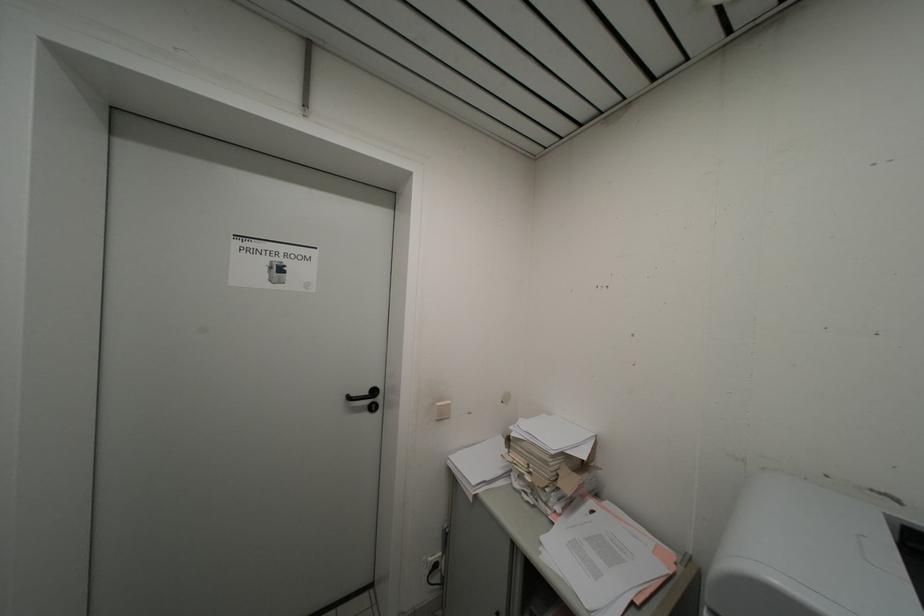
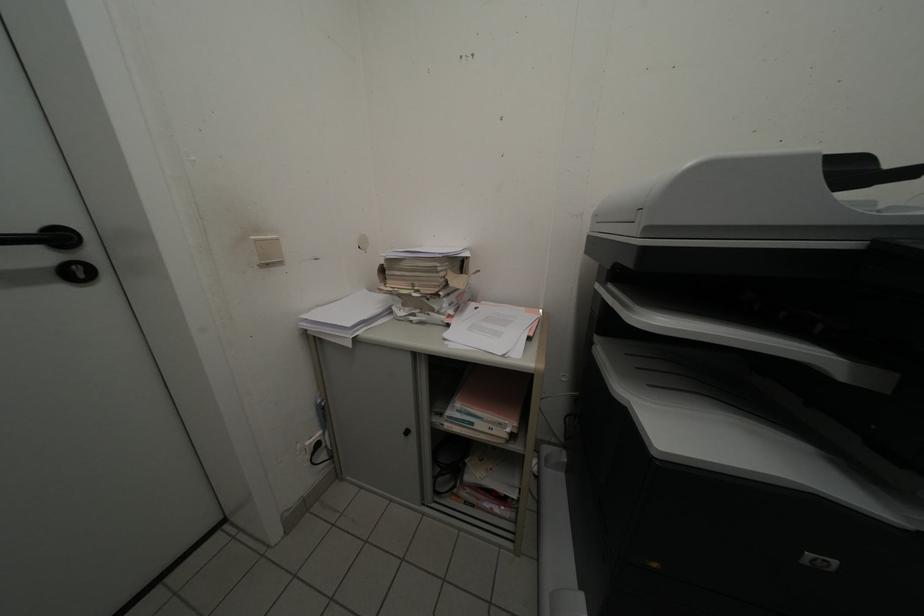
The images are taken continuously from a first-person perspective. In which direction is your viewpoint rotating?

The rotation direction of the camera is right-down.